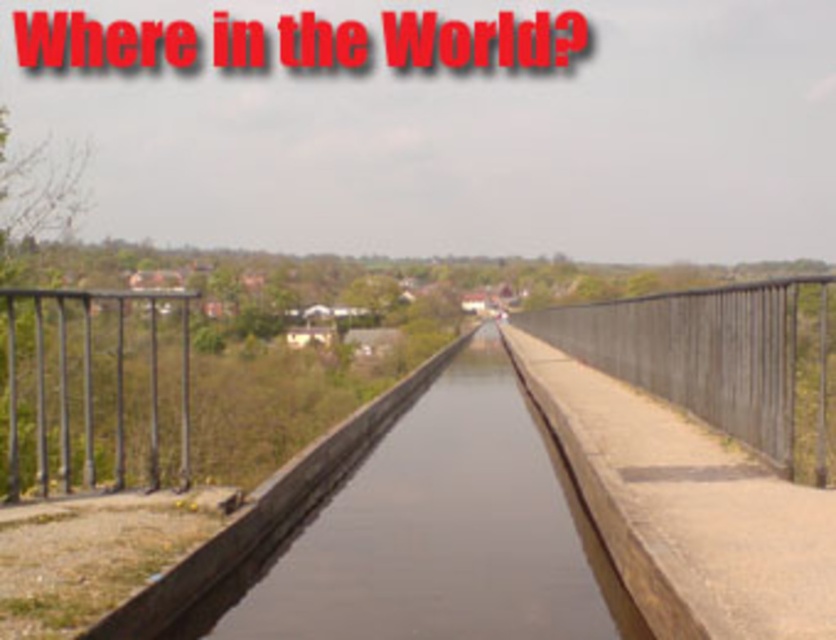
Can you confirm if metallic gray rail at right is taller than black metal railing at left?

Yes, metallic gray rail at right is taller than black metal railing at left.

You are a GUI agent. You are given a task and a screenshot of the screen. Output one action in this format:
    pyautogui.click(x=<x>, y=<y>)
    Task: Click on the metallic gray rail at right
    Image resolution: width=836 pixels, height=640 pixels.
    Given the screenshot: What is the action you would take?
    pyautogui.click(x=722, y=358)

Locate an element on the screen. This screenshot has height=640, width=836. metallic gray rail at right is located at coordinates (722, 358).